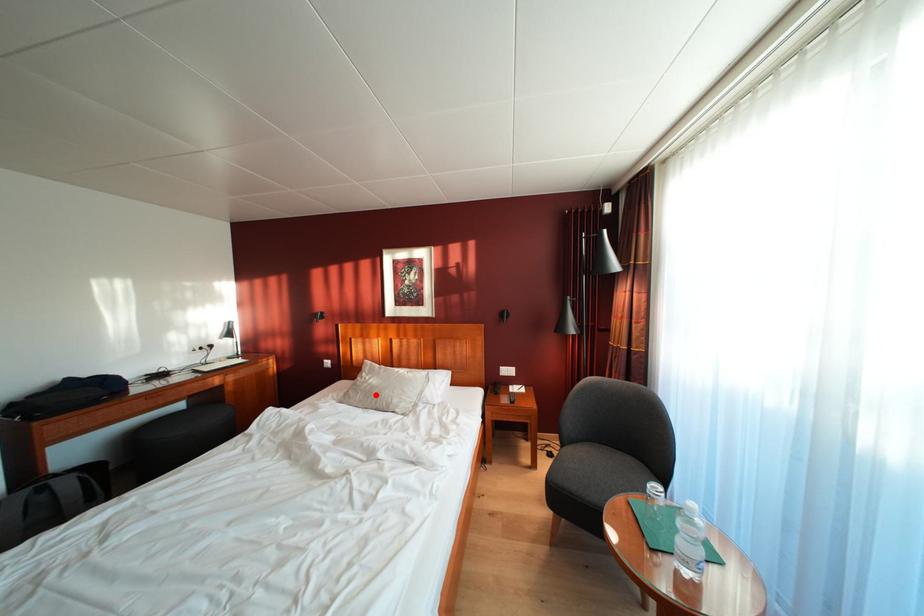
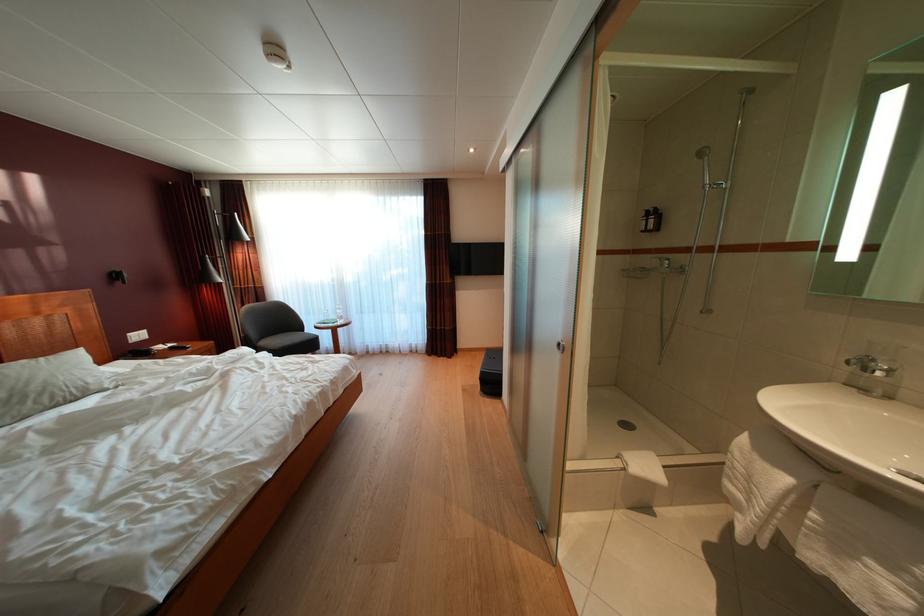
Where in the second image is the point corresponding to the highlighted location from the first image?

(10, 400)